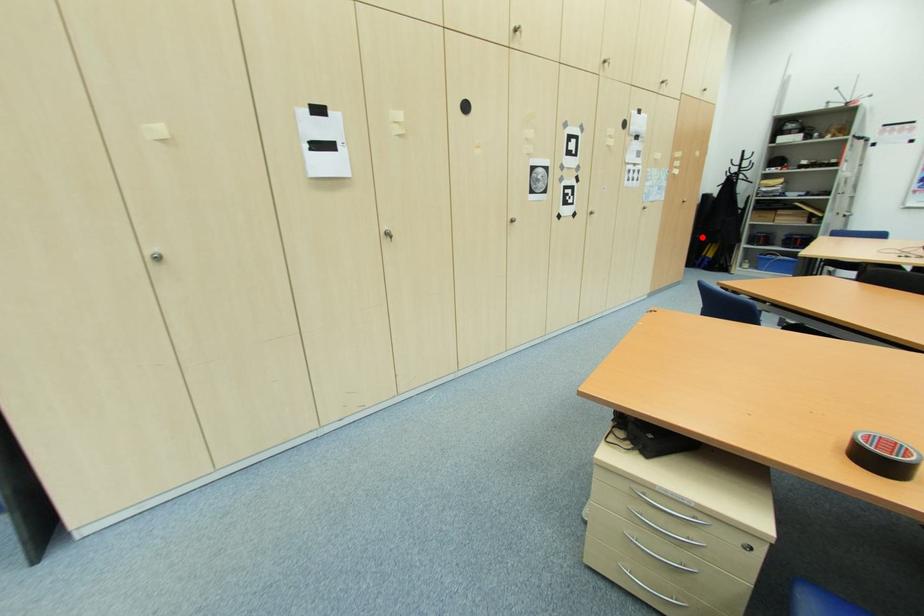
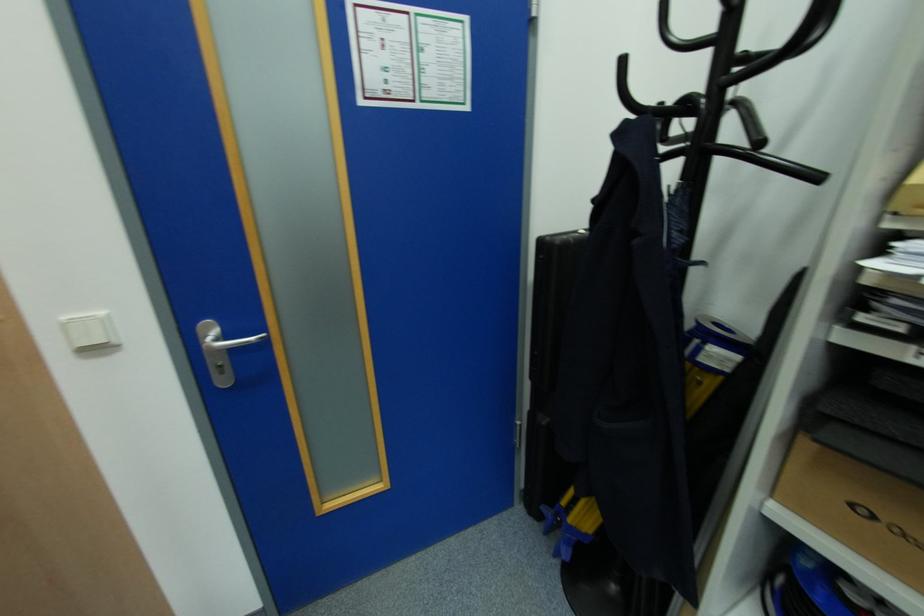
Locate, in the second image, the point that corresponds to the highlighted location in the first image.

(548, 421)